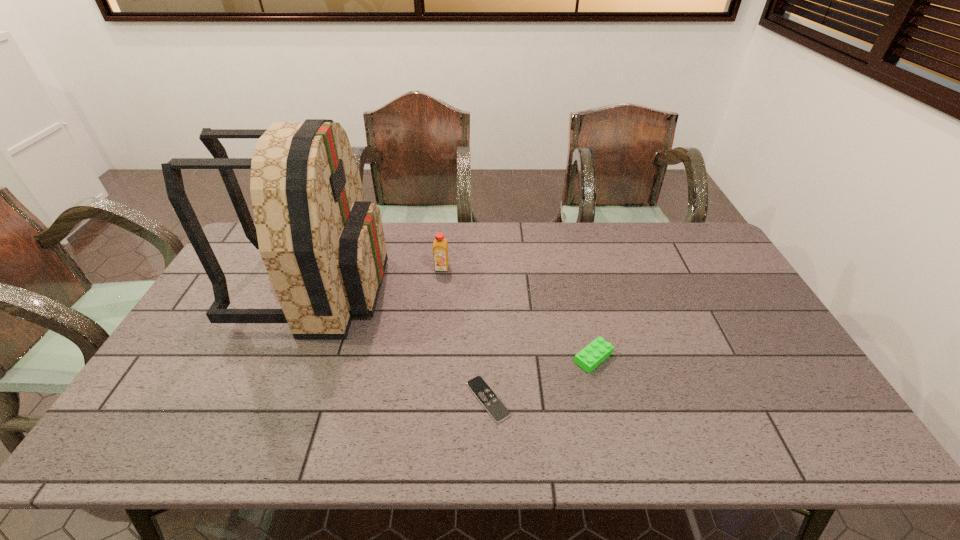
This screenshot has height=540, width=960. Find the location of `free space at the right edge`. free space at the right edge is located at coordinates (701, 300).

Image resolution: width=960 pixels, height=540 pixels. Identify the location of vacant space at the far right corner of the desktop. (687, 241).

You are a GUI agent. You are given a task and a screenshot of the screen. Output one action in this format:
    pyautogui.click(x=<x>, y=<y>)
    Task: Click on the free space that is in between the Lego and the tallest object
    Image resolution: width=960 pixels, height=540 pixels.
    Given the screenshot: What is the action you would take?
    pyautogui.click(x=455, y=323)

You are a GUI agent. You are given a task and a screenshot of the screen. Output one action in this format:
    pyautogui.click(x=<x>, y=<y>)
    Task: Click on the vacant area that lies between the tallest object and the second object from right to left
    The height and width of the screenshot is (540, 960).
    Given the screenshot: What is the action you would take?
    pyautogui.click(x=402, y=344)

Locate an element on the screen. This screenshot has width=960, height=540. vacant space that is in between the remote control and the third shortest object is located at coordinates (465, 333).

Identify the location of free spot between the shortest object and the second tallest object. The image size is (960, 540). (465, 333).

You are a GUI agent. You are given a task and a screenshot of the screen. Output one action in this format:
    pyautogui.click(x=<x>, y=<y>)
    Task: Click on the empty space that is in between the Lego and the third object from right to left
    The image size is (960, 540).
    Given the screenshot: What is the action you would take?
    pyautogui.click(x=517, y=313)

Image resolution: width=960 pixels, height=540 pixels. I want to click on vacant space in between the third farthest object and the second tallest object, so click(x=517, y=313).

This screenshot has height=540, width=960. Find the location of `free point between the tallest object and the shortest object`. free point between the tallest object and the shortest object is located at coordinates coord(402,344).

You are a GUI agent. You are given a task and a screenshot of the screen. Output one action in this format:
    pyautogui.click(x=<x>, y=<y>)
    Task: Click on the free space between the shortest object and the third shortest object
    The width and height of the screenshot is (960, 540).
    Given the screenshot: What is the action you would take?
    pyautogui.click(x=465, y=333)